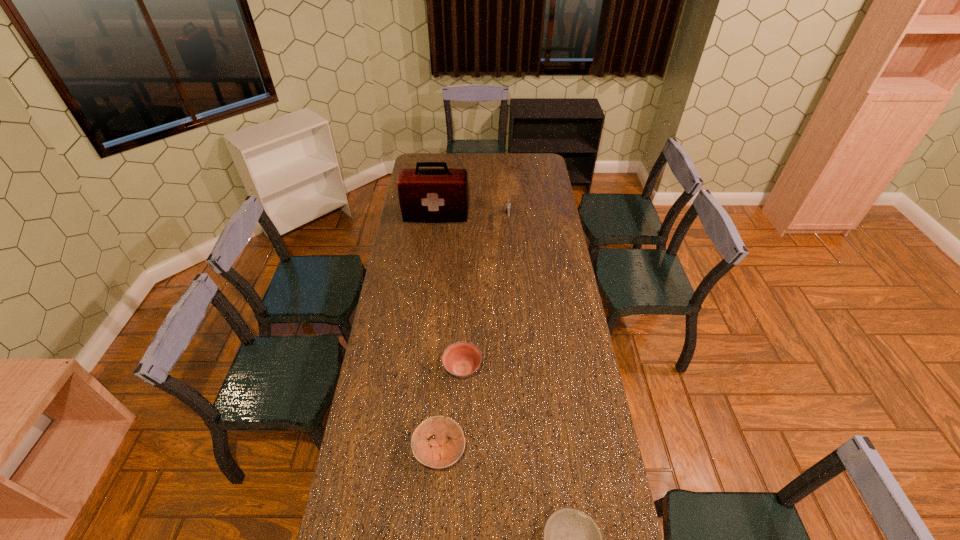
This screenshot has height=540, width=960. I want to click on the first aid kit, so click(434, 195).

Where is `gun`? gun is located at coordinates (508, 206).

You are a GUI agent. You are given a task and a screenshot of the screen. Output one action in this format:
    pyautogui.click(x=<x>, y=<y>)
    Task: Click on the fourth object from left to right
    
    Given the screenshot: What is the action you would take?
    pyautogui.click(x=508, y=206)

Identify the location of the third farthest object. The image size is (960, 540). (461, 359).

At what (x,y) coordinates should I click in order to perform the action: click on the second farthest bowl. Please return your answer as a coordinate pair (x, y). This screenshot has width=960, height=540. Looking at the image, I should click on tap(443, 453).

Identify the location of blank area located 0.050m on the side of the tallest object with the cross symbol. (434, 231).

Locate an element on the screen. The image size is (960, 540). vacant space positioned at the muzzle of the fourth shortest object is located at coordinates (510, 245).

Locate an element on the screen. The image size is (960, 540). vacant space positioned 0.370m on the right of the farthest bowl is located at coordinates (579, 370).

Find the location of a particular element. free space located 0.090m on the left of the second nearest bowl is located at coordinates (386, 451).

This screenshot has height=540, width=960. I want to click on object at the left edge, so click(434, 195).